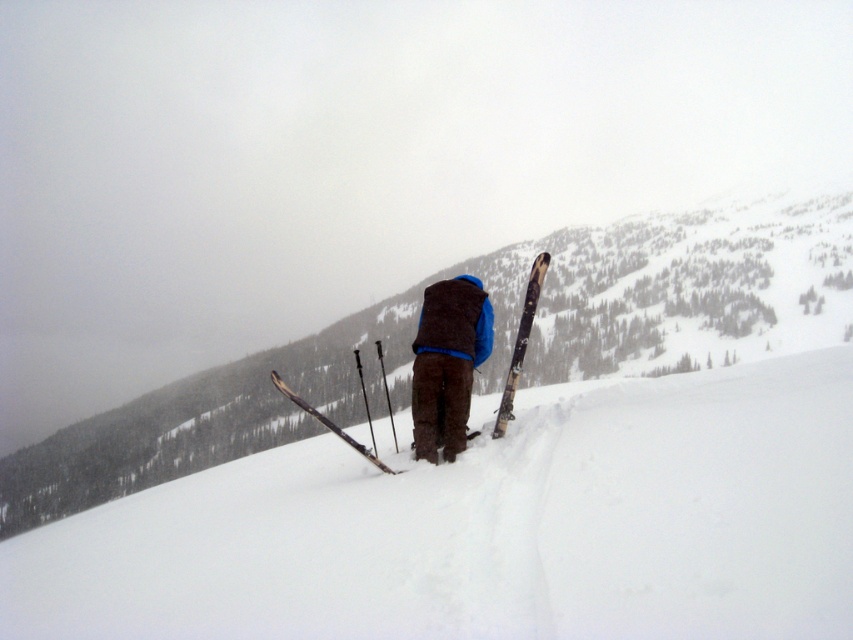
Can you confirm if white snow ski slope at center is positioned below wooden ski at center?

Incorrect, white snow ski slope at center is not positioned below wooden ski at center.

Where is `white snow ski slope at center`? white snow ski slope at center is located at coordinates (491, 525).

Is point (589, 435) positioned after point (369, 460)?

No, it is not.

The height and width of the screenshot is (640, 853). I want to click on white snow ski slope at center, so click(x=491, y=525).

Can you confirm if dark brown fleece vest at center is positioned to the left of wooden ski at right?

Indeed, dark brown fleece vest at center is positioned on the left side of wooden ski at right.

Where is `dark brown fleece vest at center`? dark brown fleece vest at center is located at coordinates pyautogui.click(x=456, y=321).

Does dark brown vest at center have a greater width compared to wooden ski at center?

In fact, dark brown vest at center might be narrower than wooden ski at center.

Does dark brown vest at center appear under wooden ski at center?

No, dark brown vest at center is not below wooden ski at center.

Where is `dark brown vest at center`? The image size is (853, 640). dark brown vest at center is located at coordinates (447, 362).

Locate an element on the screen. dark brown vest at center is located at coordinates (447, 362).